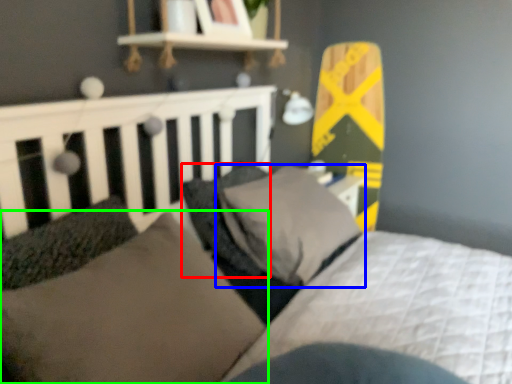
Question: Which is nearer to the pillow (highlighted by a red box)? pillow (highlighted by a blue box) or pillow (highlighted by a green box).

Choices:
 (A) pillow
 (B) pillow

Answer: (A)